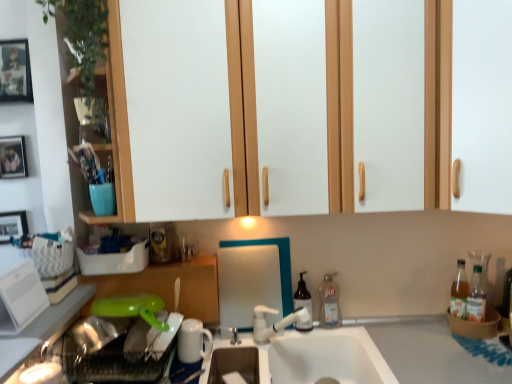
Question: Is wooden framed picture at left, the 1th picture frame when ordered from bottom to top, taller or shorter than metallic photo frame at upper left, which is counted as the 2th picture frame, starting from the front?

Choices:
 (A) short
 (B) tall

Answer: (B)

Question: Is wooden framed picture at left, placed as the 3th picture frame when sorted from front to back, in front of or behind metallic photo frame at upper left, the 2th picture frame when ordered from back to front, in the image?

Choices:
 (A) behind
 (B) front

Answer: (A)

Question: Which object is the farthest from the clear plastic bottle at sink right, the 2th bottle in the left-to-right sequence?

Choices:
 (A) translucent plastic soap dispenser at center, which is counted as the second bottle, starting from the right
 (B) white glossy cabinet at upper center
 (C) green plastic dish washer at lower left
 (D) white glossy refrigerator at left, arranged as the 1th appliance when viewed from the left
 (E) white matte cabinet door at upper right, which is the first cabinetry from right to left

Answer: (D)

Question: Which object is positioned farthest from the white ceramic sink at center?

Choices:
 (A) white glossy refrigerator at left, the 2th appliance from the bottom
 (B) metallic silver picture frame at upper left, marked as the first picture frame in a top-to-bottom arrangement
 (C) wooden framed picture at left, the 1th picture frame when ordered from bottom to top
 (D) green plastic lid at lower left, placed as the first cabinetry when sorted from bottom to top
 (E) metallic photo frame at upper left, which is counted as the 2th picture frame, starting from the front

Answer: (B)